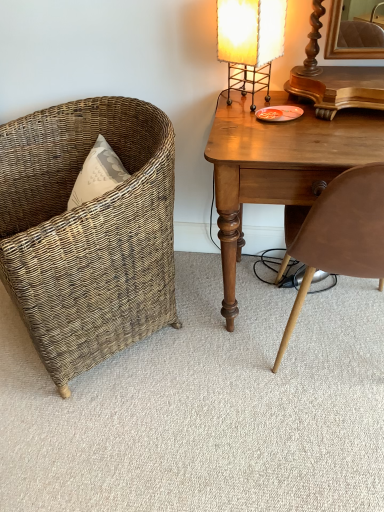
Find the location of a particular element. This screenshot has width=384, height=512. free location to the right of matte yellow fabric lampshade at upper right is located at coordinates (301, 105).